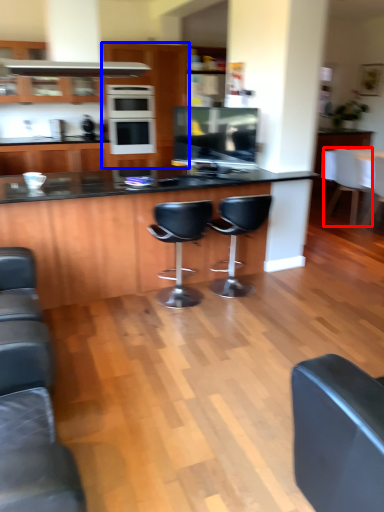
Question: Which point is further to the camera, chair (highlighted by a red box) or cabinetry (highlighted by a blue box)?

Choices:
 (A) chair
 (B) cabinetry

Answer: (B)